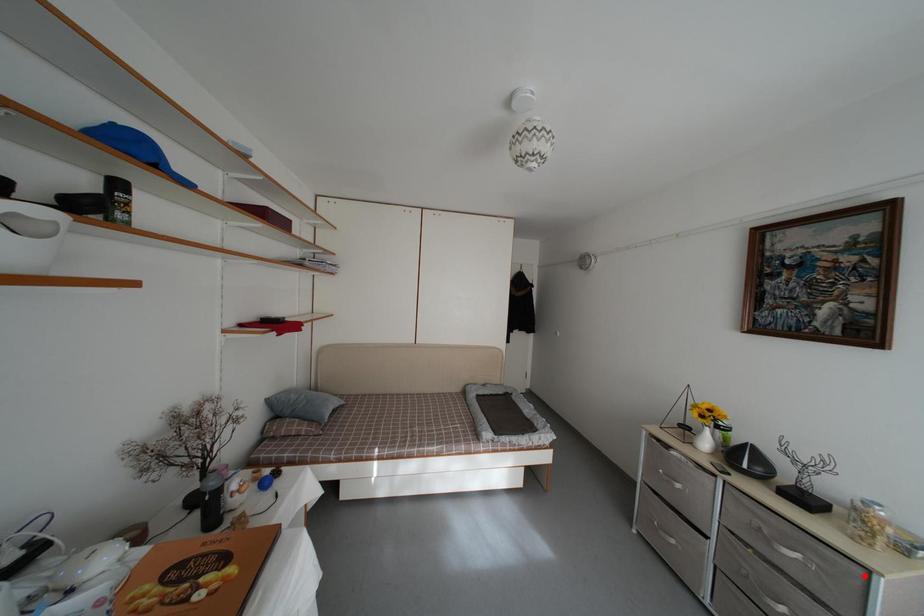
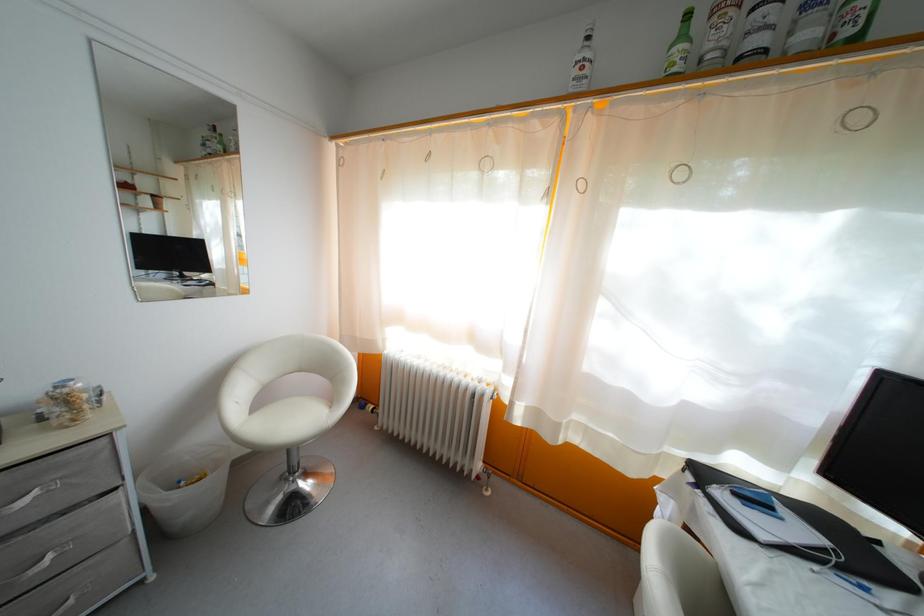
Where in the second image is the point corresponding to the highlighted location from the first image?

(110, 447)